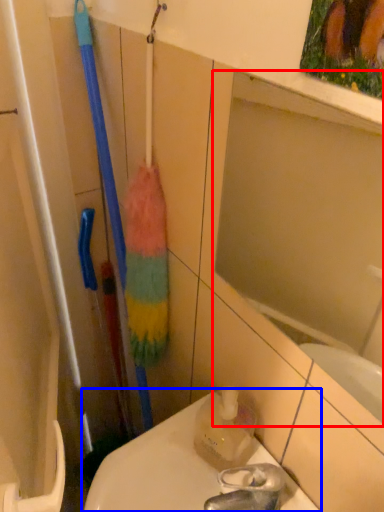
Question: Which point is further to the camera, mirror (highlighted by a red box) or toilet (highlighted by a blue box)?

Choices:
 (A) mirror
 (B) toilet

Answer: (B)